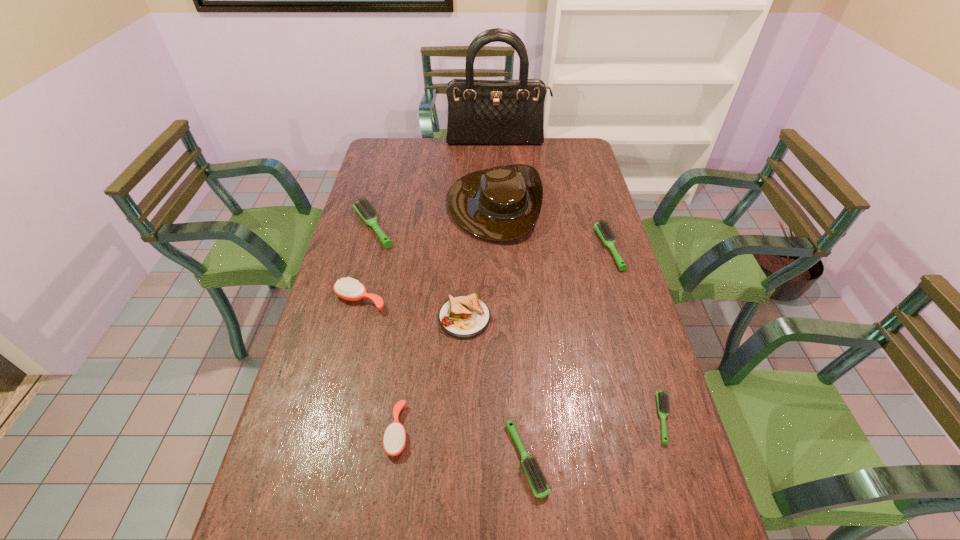
The image size is (960, 540). I want to click on the farthest object, so click(480, 112).

Where is `black handbag`? black handbag is located at coordinates (480, 112).

Where is `the eighth shortest object`? the eighth shortest object is located at coordinates (503, 203).

Locate an element on the screen. the left orange hairbrush is located at coordinates (347, 288).

In order to click on the bigger orange hairbrush in this screenshot , I will do click(x=347, y=288).

The height and width of the screenshot is (540, 960). I want to click on the biggest light hairbrush, so click(365, 210).

The height and width of the screenshot is (540, 960). I want to click on the second biggest light hairbrush, so click(605, 232).

In order to click on sandwich in this screenshot , I will do `click(466, 316)`.

At what (x,y) coordinates should I click in order to perform the action: click on the smaller orange hairbrush. Please return your answer as a coordinate pair (x, y). Looking at the image, I should click on (394, 439).

Find the location of a particular element. The image size is (960, 540). the right orange hairbrush is located at coordinates (394, 439).